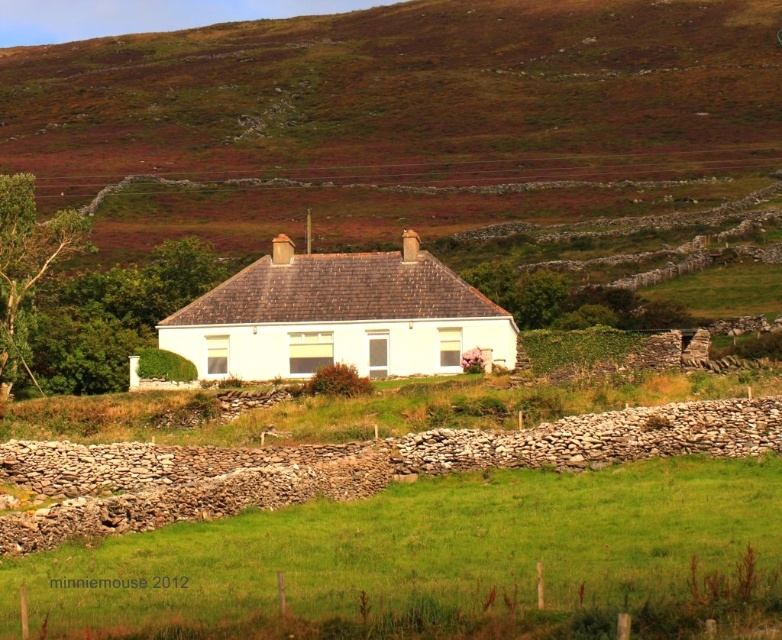
You are standing in the middle of the image and see both the green grass at center and the green grassy at center. Which one is positioned to the right side from your viewpoint?

The green grass at center is positioned to the right of the green grassy at center.

You are a landscape architect planning to install a new garden feature. You need to know which area is wider between the white smooth house at center and the green grassy at center. Which one is wider?

The green grassy at center is wider than the white smooth house at center.